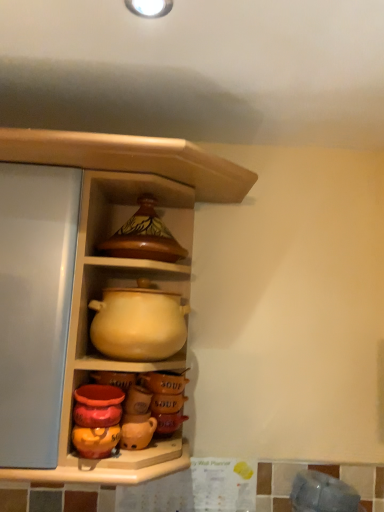
Question: Considering the positions of brown glossy pot at upper center and matte ceramic pot at upper center in the image, is brown glossy pot at upper center wider or thinner than matte ceramic pot at upper center?

Choices:
 (A) wide
 (B) thin

Answer: (B)

Question: Is point (82, 201) positioned closer to the camera than point (104, 153)?

Choices:
 (A) farther
 (B) closer

Answer: (A)

Question: Which object is positioned farthest from the matte ceramic pot at upper center?

Choices:
 (A) matte yellow clay pot at center
 (B) brown glossy pot at upper center

Answer: (A)

Question: Which of these objects is positioned farthest from the brown glossy pot at upper center?

Choices:
 (A) matte ceramic pot at upper center
 (B) matte yellow clay pot at center

Answer: (B)